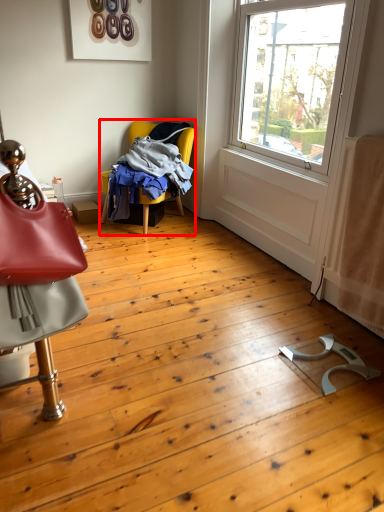
Question: From the image's perspective, what is the correct spatial positioning of chair (annotated by the red box) in reference to chair?

Choices:
 (A) above
 (B) below

Answer: (A)